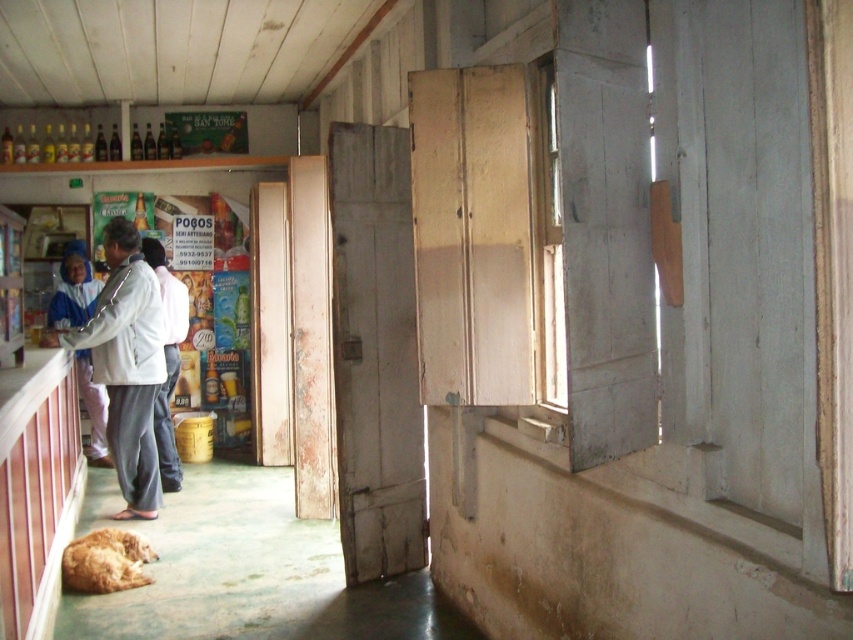
You are a customer entering the shop and see a golden fur dog at lower left and a white fabric shirt at center. Which object is closer to the entrance?

The golden fur dog at lower left is closer to the entrance than the white fabric shirt at center because it is positioned lower in the scene, which typically indicates proximity to the viewer.

You are standing at the entrance of the shop and see two points marked in the image. The first point is at coordinate point (86, 573) and the second is at point (146, 243). Which point is closer to you?

Answer: Point (86, 573) is in front of point (146, 243), so the first point is closer to you.

You are standing in the shop and want to reach both the point at coordinates (93, 298) and the point at coordinates (84, 561). Which point do you need to walk towards first to reach the one closer to you?

You should first reach the point at coordinates (93, 298) because it is closer to you than the point at coordinates (84, 561).